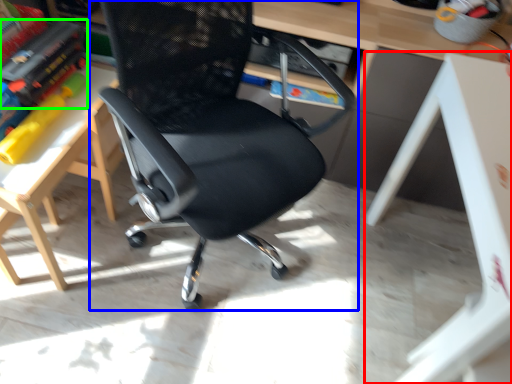
Question: Which is nearer to the table (highlighted by a red box)? chair (highlighted by a blue box) or book (highlighted by a green box).

Choices:
 (A) chair
 (B) book

Answer: (A)